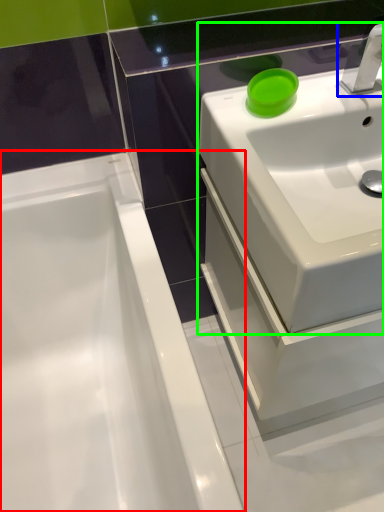
Question: Which object is positioned farthest from bathtub (highlighted by a red box)? Select from tap (highlighted by a blue box) and sink (highlighted by a green box).

Choices:
 (A) tap
 (B) sink

Answer: (A)